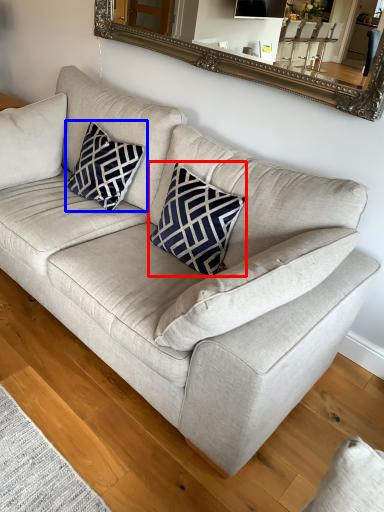
Question: Which object appears farthest to the camera in this image, throw pillow (highlighted by a red box) or pillow (highlighted by a blue box)?

Choices:
 (A) throw pillow
 (B) pillow

Answer: (B)